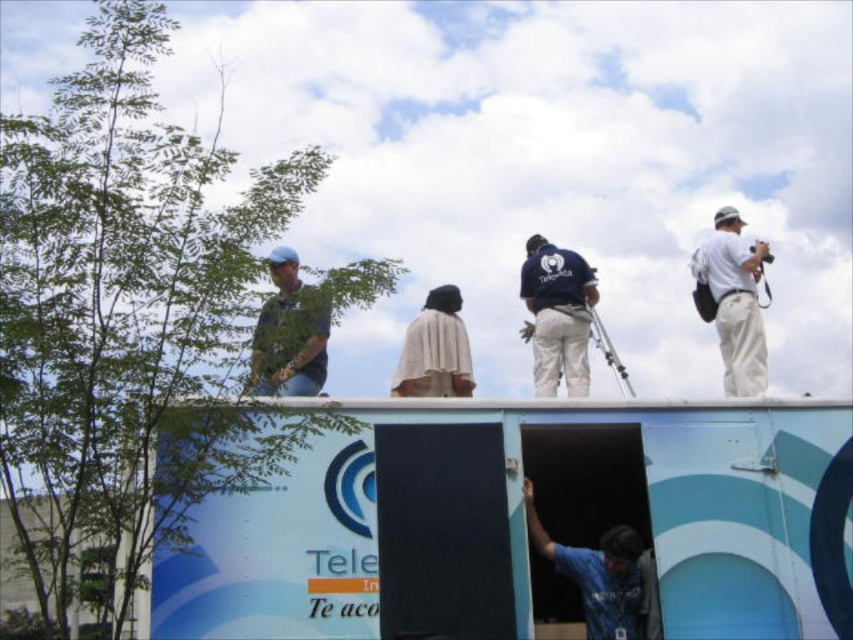
You are a photographer positioned at the front of the vehicle. You notice two people wearing blue clothing. The first person has a blue fabric shirt at lower center and the second has blue denim jeans at left. Which person is positioned lower in the image?

The blue fabric shirt at lower center is located below blue denim jeans at left, so the person wearing the blue fabric shirt at lower center is positioned lower in the image.